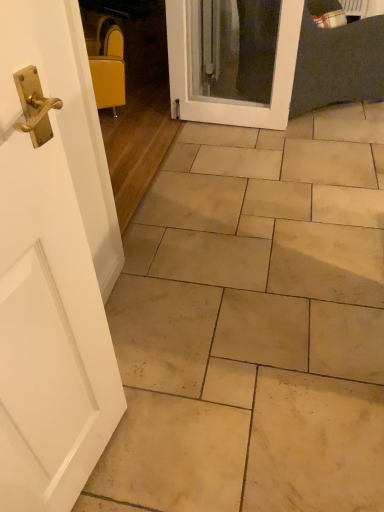
At what (x,y) coordinates should I click in order to perform the action: click on unoccupied region to the right of white glossy door at center. Please return your answer as a coordinate pair (x, y). The height and width of the screenshot is (512, 384). Looking at the image, I should click on (314, 133).